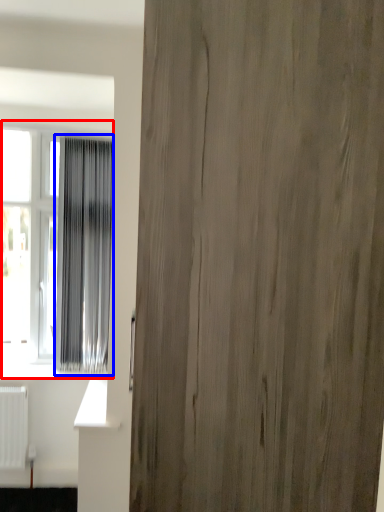
Question: Among these objects, which one is farthest to the camera, window (highlighted by a red box) or curtain (highlighted by a blue box)?

Choices:
 (A) window
 (B) curtain

Answer: (A)